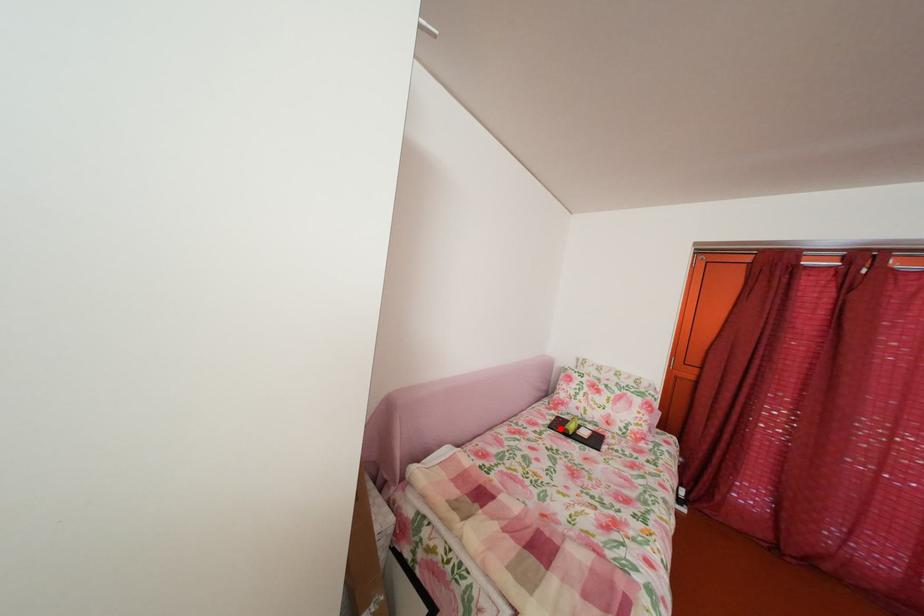
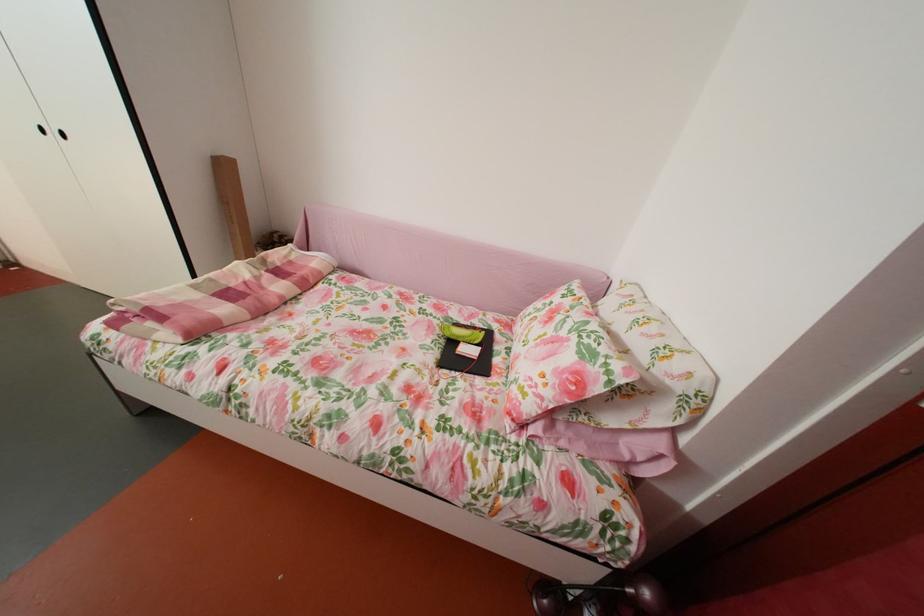
In the second image, find the point that corresponds to the highlighted location in the first image.

(473, 328)